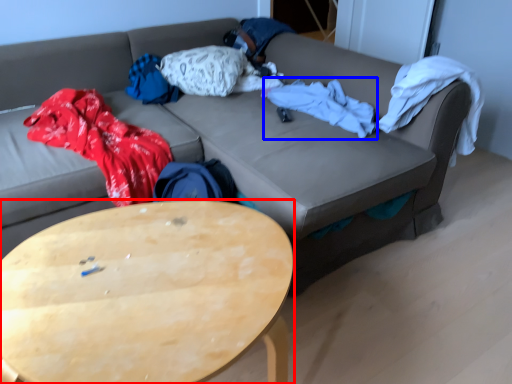
Question: Which of the following is the closest to the observer, coffee table (highlighted by a red box) or blanket (highlighted by a blue box)?

Choices:
 (A) coffee table
 (B) blanket

Answer: (A)